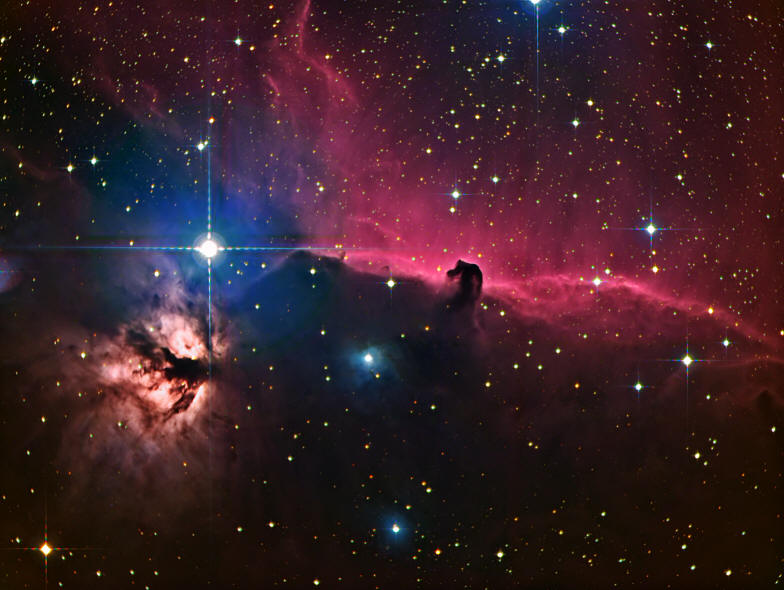
Locate an element on the screen. This screenshot has height=590, width=784. huge light is located at coordinates (205, 244).